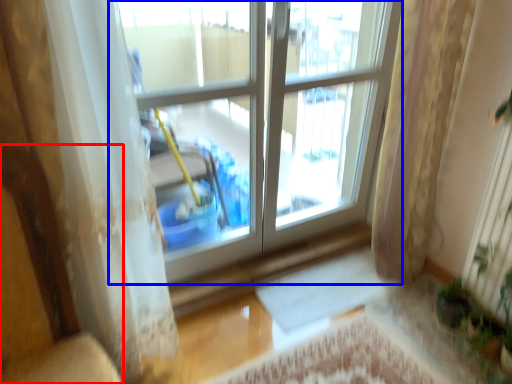
Question: Which object appears farthest to the camera in this image, armchair (highlighted by a red box) or window (highlighted by a blue box)?

Choices:
 (A) armchair
 (B) window

Answer: (B)